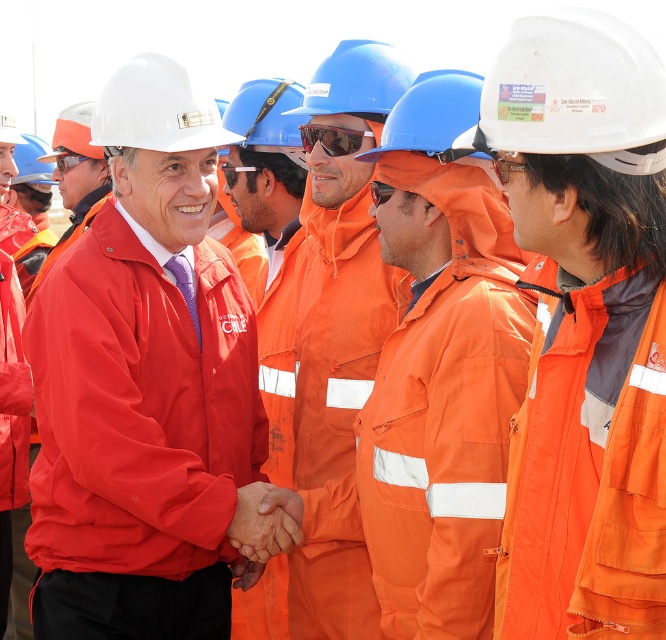
Is white matte hard hat at upper center in front of white hard hat at upper left?

Yes, white matte hard hat at upper center is in front of white hard hat at upper left.

Who is more distant from viewer, (599, 54) or (155, 125)?

Positioned behind is point (155, 125).

Is point (577, 56) less distant than point (153, 115)?

That is True.

This screenshot has width=666, height=640. I want to click on white matte hard hat at upper center, so click(573, 92).

Measure the distance between point [87,112] and camera.

The distance of point [87,112] from camera is 14.14 meters.

Is point (91, 157) positioned in front of point (77, 157)?

Yes, point (91, 157) is in front of point (77, 157).

Where is `matte orange hard hat at left`? matte orange hard hat at left is located at coordinates (75, 177).

Can you confirm if orange fabric uniform at center is positioned to the right of orange matte safety goggles at center?

Yes, orange fabric uniform at center is to the right of orange matte safety goggles at center.

Which is below, orange fabric uniform at center or orange matte safety goggles at center?

orange fabric uniform at center

The image size is (666, 640). I want to click on orange fabric uniform at center, so 342,262.

I want to click on orange fabric uniform at center, so click(x=342, y=262).